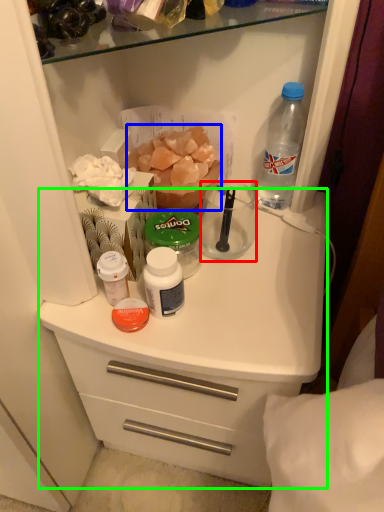
Question: Which is farther away from coffee cup (highlighted by a red box)? food (highlighted by a blue box) or counter (highlighted by a green box)?

Choices:
 (A) food
 (B) counter

Answer: (B)